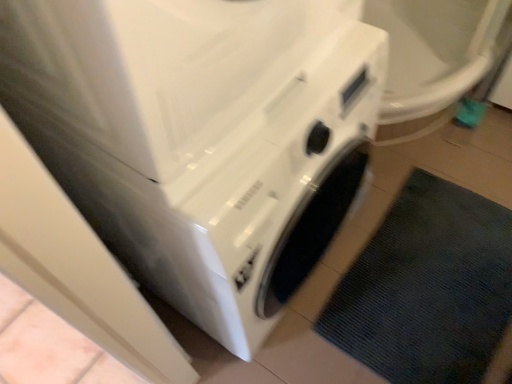
In order to click on vacant space behind dark gray textured bath mat at lower right in this screenshot , I will do `click(426, 169)`.